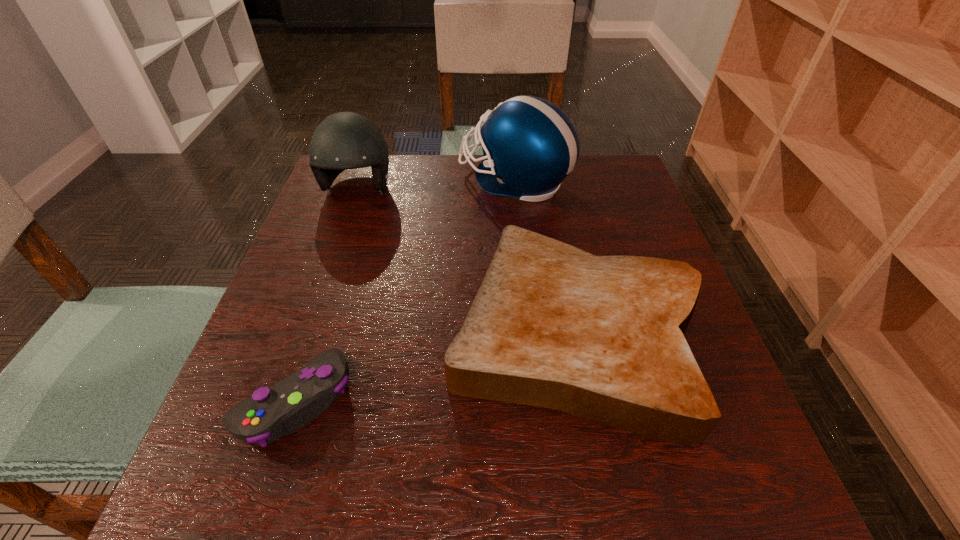
Where is `the right football helmet`? the right football helmet is located at coordinates (529, 145).

The width and height of the screenshot is (960, 540). Identify the location of the left football helmet. (345, 140).

Where is `bread`? Image resolution: width=960 pixels, height=540 pixels. bread is located at coordinates (601, 337).

Find the location of a particular element. Image resolution: width=960 pixels, height=540 pixels. the shortest object is located at coordinates (287, 406).

In order to click on vacant space situated 0.050m at the front of the right football helmet with the faceguard in this screenshot , I will do `click(440, 181)`.

Find the location of a particular element. The height and width of the screenshot is (540, 960). blank area located 0.250m at the front of the right football helmet with the faceguard is located at coordinates (365, 181).

Locate an element on the screen. Image resolution: width=960 pixels, height=540 pixels. vacant space located at the front of the right football helmet with the faceguard is located at coordinates (410, 181).

Locate an element on the screen. The height and width of the screenshot is (540, 960). free space located 0.140m at the face opening of the left football helmet is located at coordinates (336, 252).

Where is `free space located 0.210m on the left of the bread`? free space located 0.210m on the left of the bread is located at coordinates (337, 332).

Where is `vacant region located 0.110m on the back of the shortest object`? vacant region located 0.110m on the back of the shortest object is located at coordinates (325, 307).